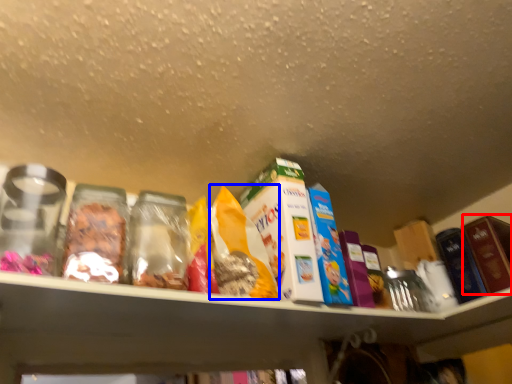
Question: Which of the following is the farthest to the observer, product (highlighted by a red box) or cereal (highlighted by a blue box)?

Choices:
 (A) product
 (B) cereal

Answer: (A)